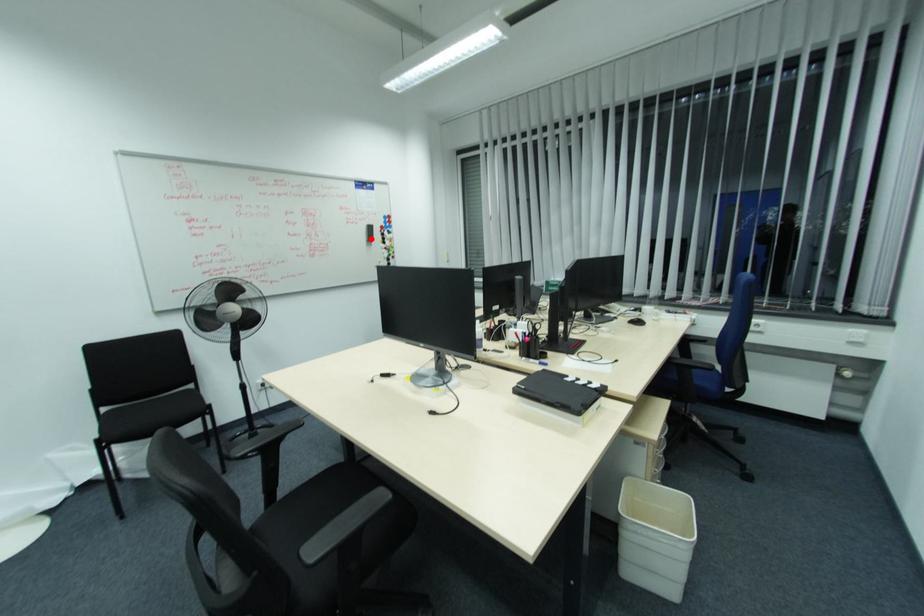
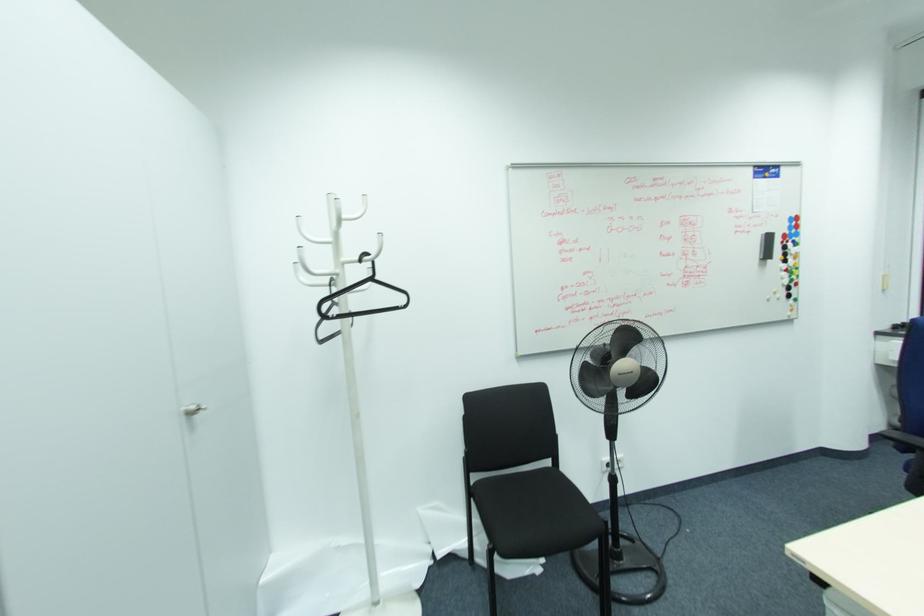
Locate, in the second image, the point that corresponds to the highlighted location in the first image.

(768, 256)